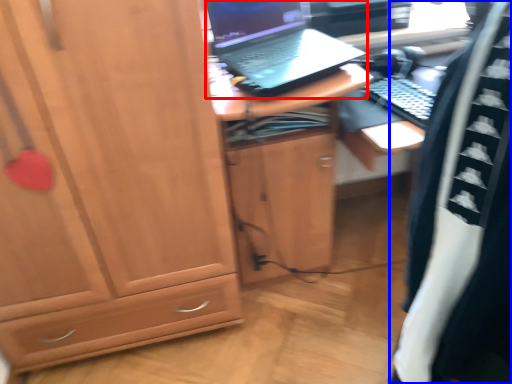
Question: Which object is closer to the camera taking this photo, laptop (highlighted by a red box) or clothing (highlighted by a blue box)?

Choices:
 (A) laptop
 (B) clothing

Answer: (B)